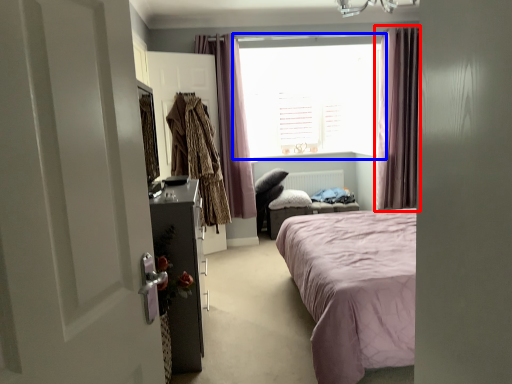
Question: Among these objects, which one is farthest to the camera, curtain (highlighted by a red box) or window (highlighted by a blue box)?

Choices:
 (A) curtain
 (B) window

Answer: (B)